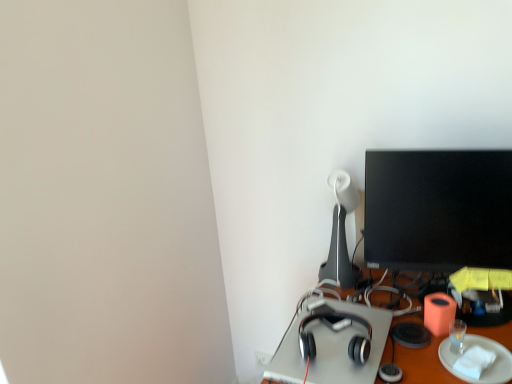
Question: Are white paper plate at lower right and white glossy table lamp at upper right making contact?

Choices:
 (A) no
 (B) yes

Answer: (A)

Question: Can you confirm if white paper plate at lower right is bigger than white glossy table lamp at upper right?

Choices:
 (A) yes
 (B) no

Answer: (B)

Question: Could white glossy table lamp at upper right be considered to be inside white paper plate at lower right?

Choices:
 (A) yes
 (B) no

Answer: (B)

Question: Can you confirm if white paper plate at lower right is thinner than white glossy table lamp at upper right?

Choices:
 (A) no
 (B) yes

Answer: (A)

Question: Can you confirm if white paper plate at lower right is taller than white glossy table lamp at upper right?

Choices:
 (A) yes
 (B) no

Answer: (B)

Question: Looking at their shapes, would you say white glossy table lamp at upper right is wider or thinner than white paper plate at lower right?

Choices:
 (A) wide
 (B) thin

Answer: (B)

Question: In the image, is white glossy table lamp at upper right positioned in front of or behind white paper plate at lower right?

Choices:
 (A) front
 (B) behind

Answer: (B)

Question: Visually, is white glossy table lamp at upper right positioned to the left or to the right of white paper plate at lower right?

Choices:
 (A) right
 (B) left

Answer: (B)

Question: From the image's perspective, is white glossy table lamp at upper right above or below white paper plate at lower right?

Choices:
 (A) below
 (B) above

Answer: (B)

Question: From the image's perspective, relative to white glossy table lamp at upper right, is white paper plate at lower right above or below?

Choices:
 (A) below
 (B) above

Answer: (A)

Question: Is white paper plate at lower right bigger or smaller than white glossy table lamp at upper right?

Choices:
 (A) big
 (B) small

Answer: (B)

Question: Relative to white glossy table lamp at upper right, is white paper plate at lower right in front or behind?

Choices:
 (A) behind
 (B) front

Answer: (B)

Question: From a real-world perspective, is white paper plate at lower right above or below white glossy table lamp at upper right?

Choices:
 (A) above
 (B) below

Answer: (B)

Question: Does point (314, 317) appear closer or farther from the camera than point (330, 269)?

Choices:
 (A) closer
 (B) farther

Answer: (A)

Question: Relative to white glossy table lamp at upper right, is satin silver headphones at center-right in front or behind?

Choices:
 (A) front
 (B) behind

Answer: (A)